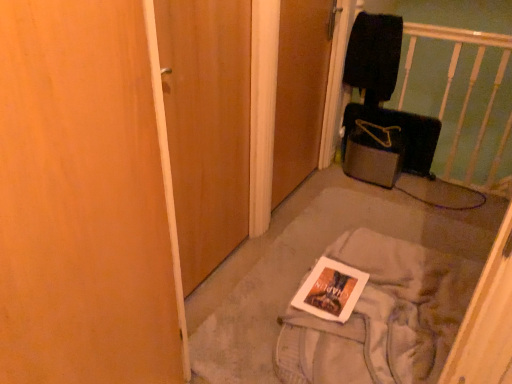
Question: Is white glossy magazine at center further to camera compared to black fabric infant bed at upper right?

Choices:
 (A) no
 (B) yes

Answer: (A)

Question: Does white glossy magazine at center appear on the right side of black fabric infant bed at upper right?

Choices:
 (A) no
 (B) yes

Answer: (A)

Question: Does white glossy magazine at center appear on the left side of black fabric infant bed at upper right?

Choices:
 (A) yes
 (B) no

Answer: (A)

Question: Is white glossy magazine at center aimed at black fabric infant bed at upper right?

Choices:
 (A) no
 (B) yes

Answer: (A)

Question: Considering the relative positions of white glossy magazine at center and black fabric infant bed at upper right in the image provided, is white glossy magazine at center in front of black fabric infant bed at upper right?

Choices:
 (A) no
 (B) yes

Answer: (B)

Question: From a real-world perspective, is wooden door at center, the 1th door when ordered from left to right, physically located above or below velvet black suitcase at right?

Choices:
 (A) above
 (B) below

Answer: (A)

Question: In the image, is wooden door at center, the 2th door when ordered from right to left, positioned in front of or behind velvet black suitcase at right?

Choices:
 (A) front
 (B) behind

Answer: (A)

Question: Does point (173, 152) appear closer or farther from the camera than point (378, 120)?

Choices:
 (A) closer
 (B) farther

Answer: (A)

Question: Considering the positions of wooden door at center, the 1th door when ordered from left to right, and velvet black suitcase at right in the image, is wooden door at center, the 1th door when ordered from left to right, bigger or smaller than velvet black suitcase at right?

Choices:
 (A) big
 (B) small

Answer: (A)

Question: Is wooden door at center, which is the 2th door in left-to-right order, wider or thinner than black fabric infant bed at upper right?

Choices:
 (A) wide
 (B) thin

Answer: (B)

Question: From the image's perspective, is wooden door at center, which is the 2th door in left-to-right order, located above or below black fabric infant bed at upper right?

Choices:
 (A) below
 (B) above

Answer: (A)

Question: Considering their positions, is wooden door at center, which is the 2th door in left-to-right order, located in front of or behind black fabric infant bed at upper right?

Choices:
 (A) front
 (B) behind

Answer: (A)

Question: Do you think wooden door at center, which is counted as the 1th door, starting from the right, is within black fabric infant bed at upper right, or outside of it?

Choices:
 (A) inside
 (B) outside

Answer: (B)

Question: Would you say white fabric book at center is to the left or to the right of white glossy magazine at center in the picture?

Choices:
 (A) right
 (B) left

Answer: (A)

Question: Considering the positions of white fabric book at center and white glossy magazine at center in the image, is white fabric book at center taller or shorter than white glossy magazine at center?

Choices:
 (A) tall
 (B) short

Answer: (A)